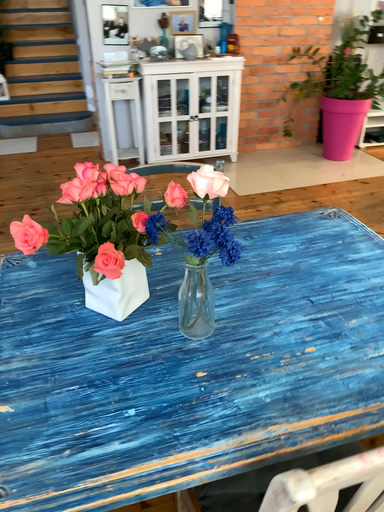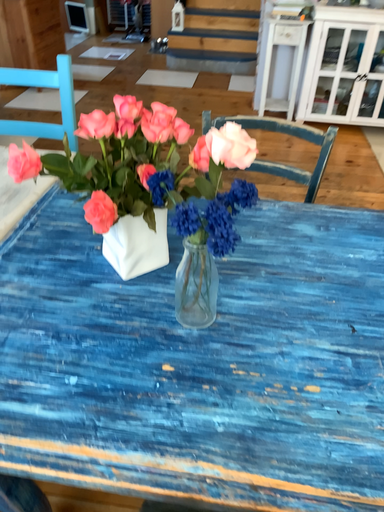
Question: Which way did the camera rotate in the video?

Choices:
 (A) rotated right
 (B) rotated left

Answer: (B)